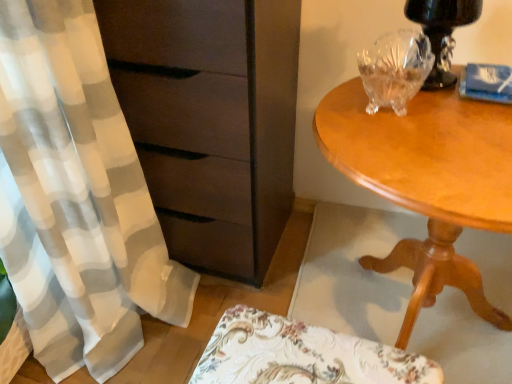
Question: Is transparent crystal bowl at upper right wider or thinner than floral fabric cushion at lower center?

Choices:
 (A) thin
 (B) wide

Answer: (B)

Question: Is point (373, 84) closer or farther from the camera than point (318, 374)?

Choices:
 (A) farther
 (B) closer

Answer: (A)

Question: Considering the real-world distances, which object is closest to the light brown wood table at right?

Choices:
 (A) transparent crystal bowl at upper right
 (B) floral fabric cushion at lower center
 (C) matte brown chest of drawers at left
 (D) black glossy table lamp at upper right

Answer: (A)

Question: Based on their relative distances, which object is nearer to the transparent crystal bowl at upper right?

Choices:
 (A) floral fabric cushion at lower center
 (B) light brown wood table at right
 (C) matte brown chest of drawers at left
 (D) black glossy table lamp at upper right

Answer: (D)